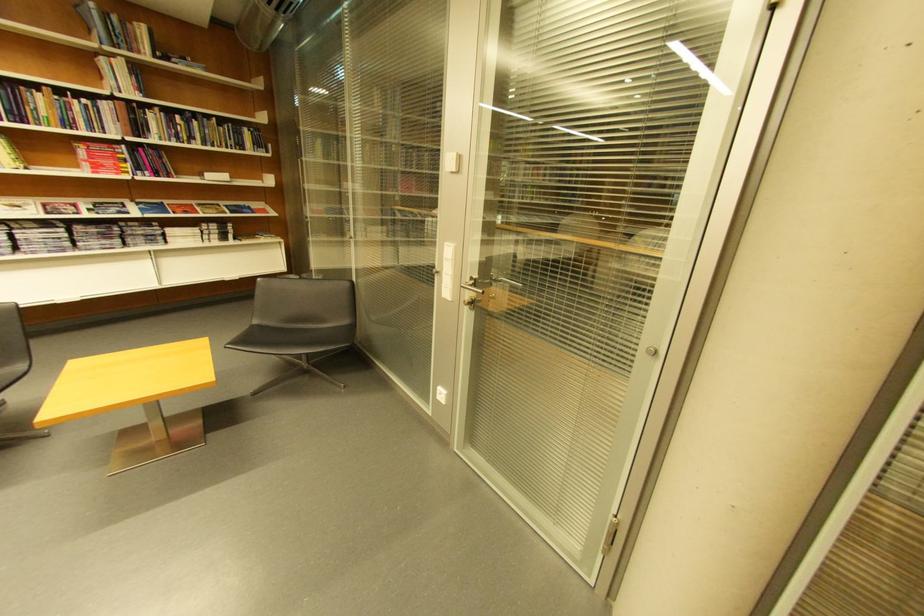
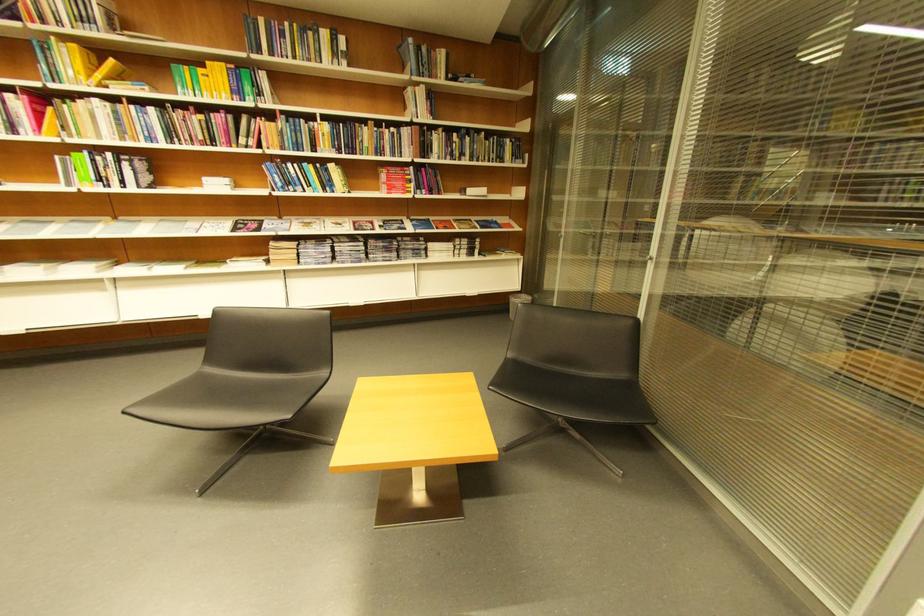
In the second image, find the point that corresponds to point 140,52 in the first image.

(441, 78)